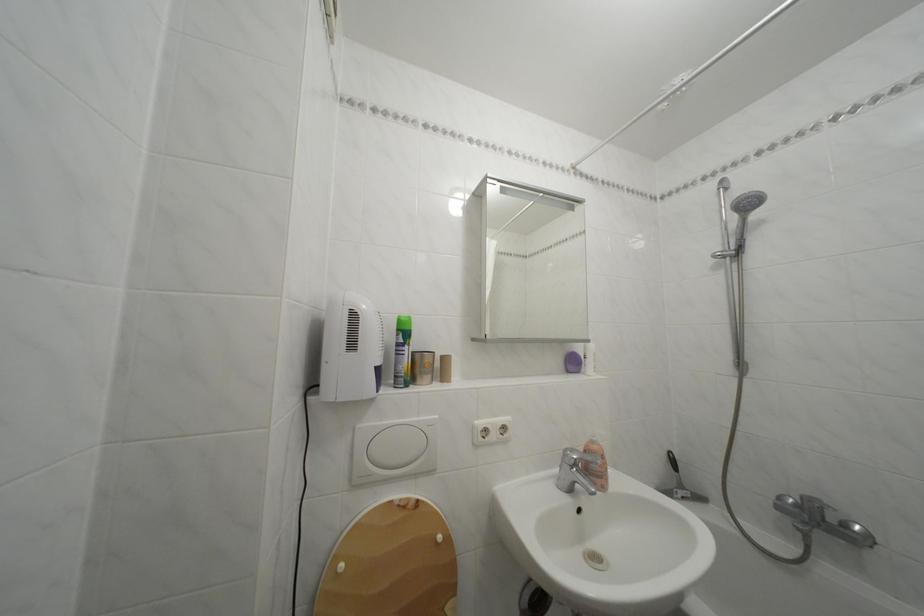
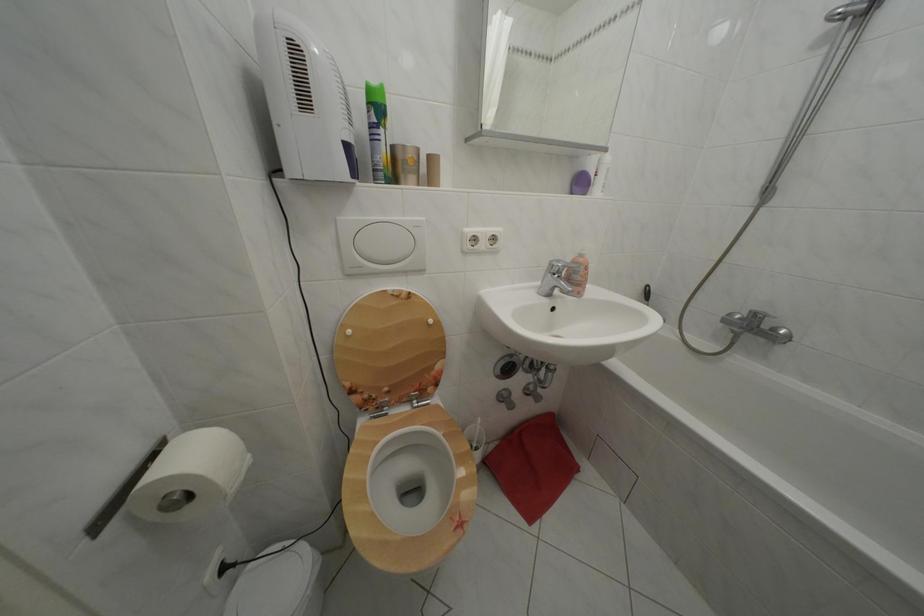
In the second image, find the point that corresponds to pixel 350 573 in the first image.

(358, 338)